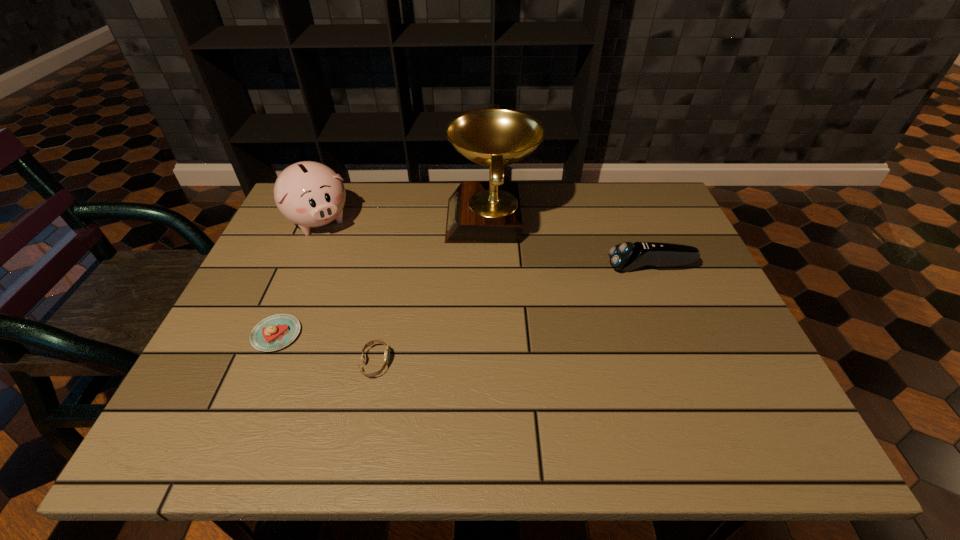
Locate an element on the screen. The height and width of the screenshot is (540, 960). free point between the third object from left to right and the tallest object is located at coordinates (433, 292).

Find the location of a particular element. The width and height of the screenshot is (960, 540). vacant area that lies between the fourth object from left to right and the piggy bank is located at coordinates [x=405, y=221].

You are a GUI agent. You are given a task and a screenshot of the screen. Output one action in this format:
    pyautogui.click(x=<x>, y=<y>)
    Task: Click on the unoccupied area between the watch and the fourth shortest object
    This screenshot has height=540, width=960.
    Given the screenshot: What is the action you would take?
    pyautogui.click(x=348, y=292)

Where is `vacant point located between the award and the rightmost object`? The image size is (960, 540). vacant point located between the award and the rightmost object is located at coordinates (571, 244).

Find the location of `vacant area between the rightmost object and the tallest object`. vacant area between the rightmost object and the tallest object is located at coordinates (571, 244).

This screenshot has width=960, height=540. Identify the location of empty space that is in between the fourth shortest object and the electric shaver. (485, 244).

Identify which object is the second closest to the piggy bank. Please provide its 2D coordinates. Your answer should be formatted as a tuple, i.e. [(x, y)], where the tuple contains the x and y coordinates of a point satisfying the conditions above.

[(478, 212)]

Locate which object ranks in proximity to the pastry. Please provide its 2D coordinates. Your answer should be formatted as a tuple, i.e. [(x, y)], where the tuple contains the x and y coordinates of a point satisfying the conditions above.

[(387, 350)]

Identify the location of free spot that satisfies the following two spatial constraints: 1. on the head of the rightmost object; 2. on the front side of the pastry. (678, 334).